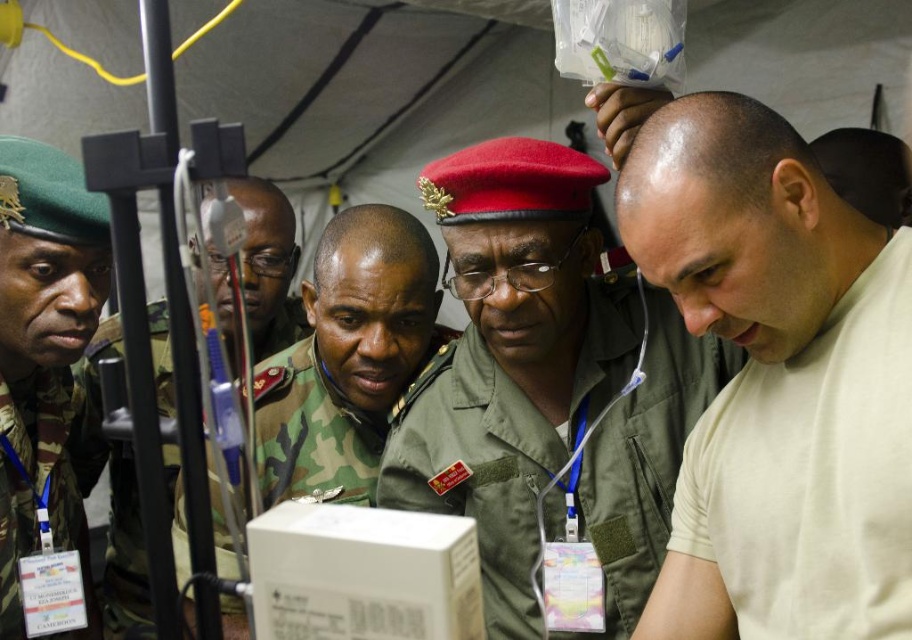
Is point (773, 236) positioned after point (57, 413)?

No.

This screenshot has height=640, width=912. What do you see at coordinates (747, 349) in the screenshot?
I see `beige cotton shirt at center` at bounding box center [747, 349].

Find the location of `beige cotton shirt at center`. beige cotton shirt at center is located at coordinates (747, 349).

Measure the distance from camouflage uniform at center to camouflage fabric uniform at left.

A distance of 13.08 inches exists between camouflage uniform at center and camouflage fabric uniform at left.

How much distance is there between camouflage uniform at center and camouflage fabric uniform at left?

camouflage uniform at center and camouflage fabric uniform at left are 33.23 centimeters apart from each other.

Does point (350, 269) come in front of point (71, 484)?

Yes, it is in front of point (71, 484).

Where is `camouflage uniform at center`? camouflage uniform at center is located at coordinates (350, 358).

Which is in front, point (355, 346) or point (92, 397)?

Point (355, 346) is more forward.

In the scene shown: Is camouflage uniform at center behind camo uniform at left?

No, it is not.

Between point (386, 420) and point (257, 253), which one is positioned behind?

Positioned behind is point (257, 253).

Where is `camouflage uniform at center`? camouflage uniform at center is located at coordinates (350, 358).